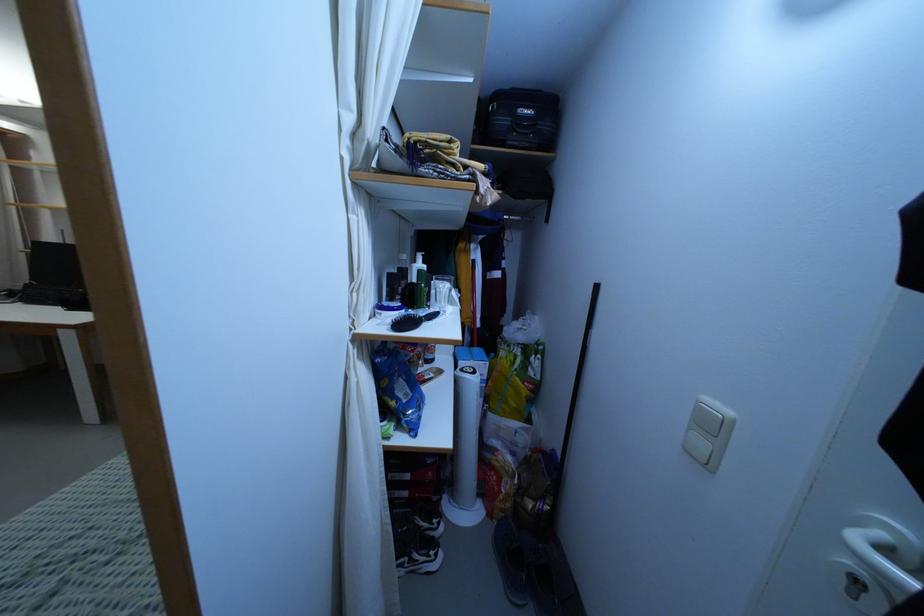
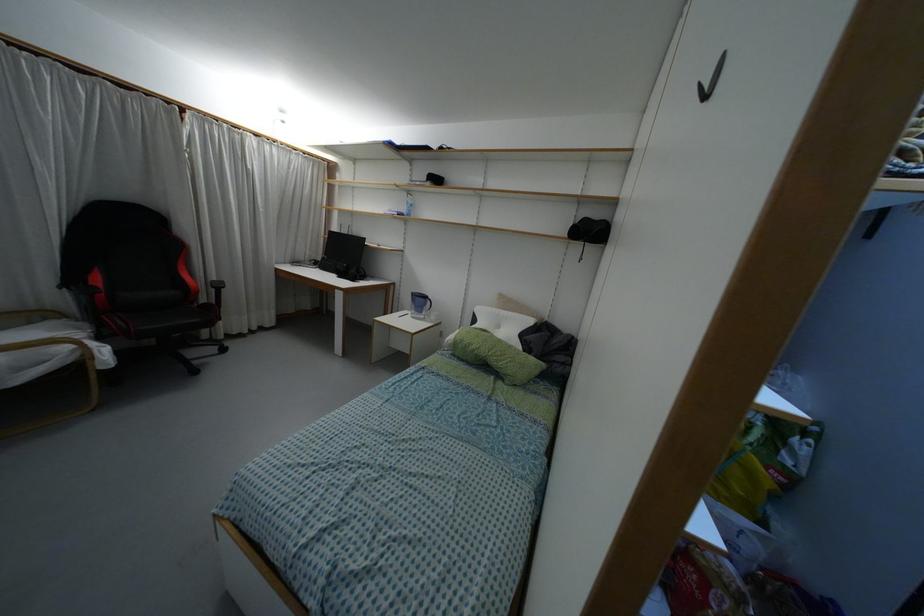
Question: The first image is from the beginning of the video and the second image is from the end. How did the camera likely rotate when shooting the video?

Choices:
 (A) Left
 (B) Right
 (C) Up
 (D) Down

Answer: (A)